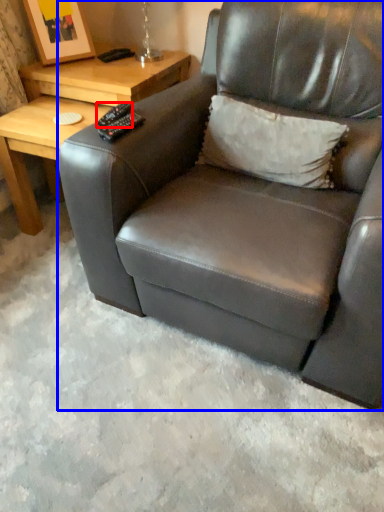
Question: Which object appears closest to the camera in this image, remote (highlighted by a red box) or chair (highlighted by a blue box)?

Choices:
 (A) remote
 (B) chair

Answer: (B)